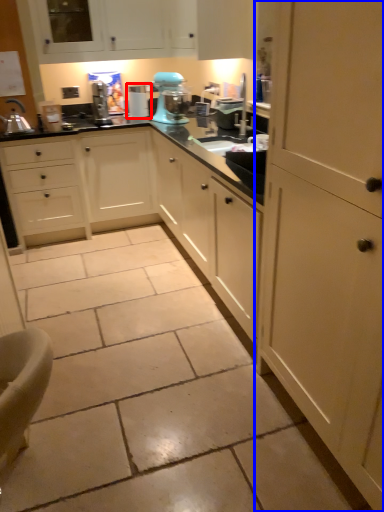
Question: Which point is closer to the camera, coffee machine (highlighted by a red box) or cabinetry (highlighted by a blue box)?

Choices:
 (A) coffee machine
 (B) cabinetry

Answer: (B)